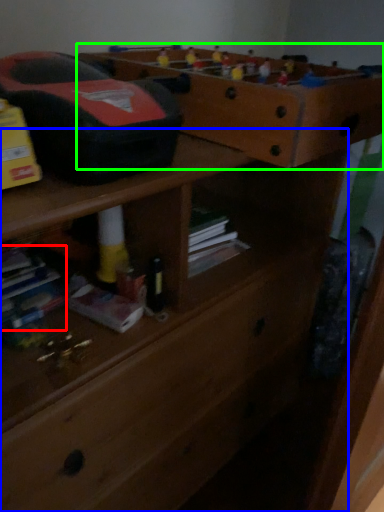
Question: Considering the real-world distances, which object is farthest from book (highlighted by a red box)? chest of drawers (highlighted by a blue box) or shelf (highlighted by a green box)?

Choices:
 (A) chest of drawers
 (B) shelf

Answer: (B)